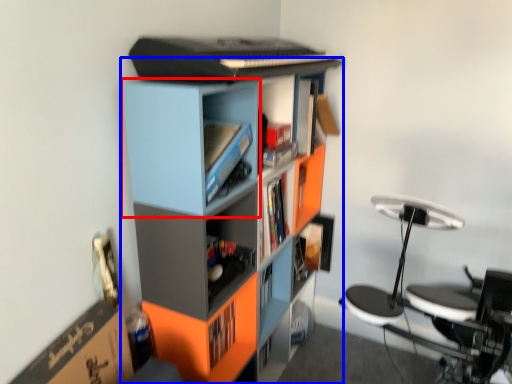
Question: Which of the following is the closest to the observer, cabinet (highlighted by a red box) or bookcase (highlighted by a blue box)?

Choices:
 (A) cabinet
 (B) bookcase

Answer: (B)